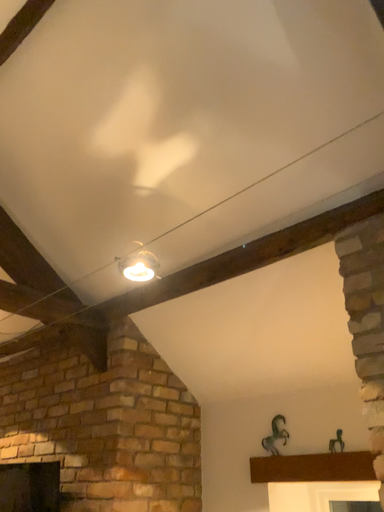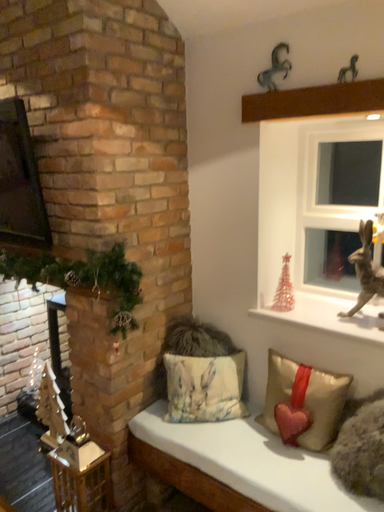
Question: Which way did the camera rotate in the video?

Choices:
 (A) rotated upward
 (B) rotated downward

Answer: (B)